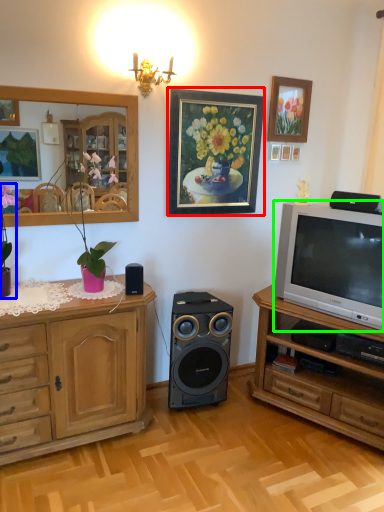
Question: Estimate the real-world distances between objects in this image. Which object is farther from picture frame (highlighted by a red box), houseplant (highlighted by a blue box) or television (highlighted by a green box)?

Choices:
 (A) houseplant
 (B) television

Answer: (A)